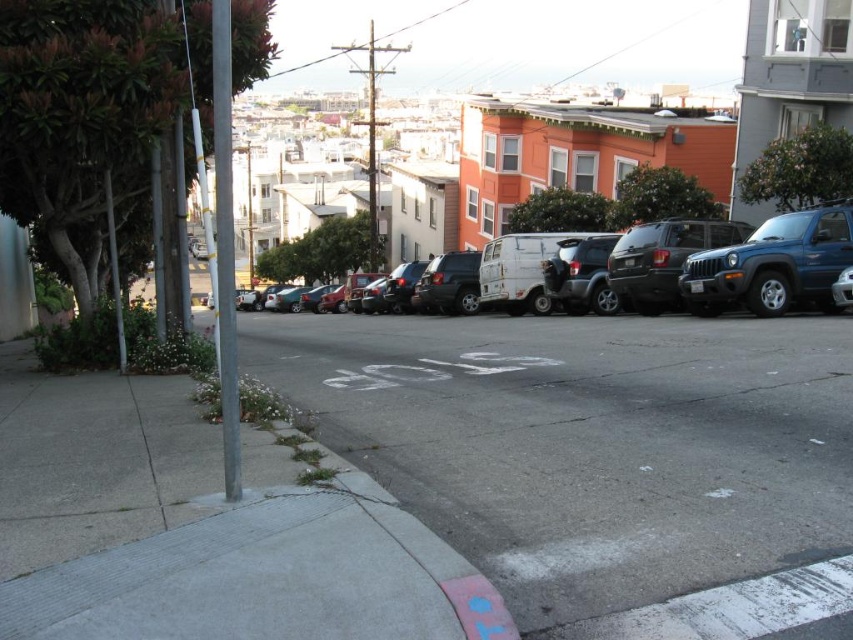
Does matte white van at center have a larger size compared to blue metallic suv at right?

Correct, matte white van at center is larger in size than blue metallic suv at right.

Does matte white van at center have a lesser width compared to blue metallic suv at right?

Incorrect, matte white van at center's width is not less than blue metallic suv at right's.

Is point (821, 264) positioned in front of point (717, 312)?

Yes, point (821, 264) is closer to viewer.

Image resolution: width=853 pixels, height=640 pixels. Identify the location of matte white van at center. (755, 262).

Who is positioned more to the right, blue metallic suv at right or silver metallic pole at left?

blue metallic suv at right is more to the right.

Identify the location of blue metallic suv at right. (773, 264).

Does matte white van at center come in front of silver metallic pole at left?

No.

Between matte white van at center and silver metallic pole at left, which one has less height?

Standing shorter between the two is silver metallic pole at left.

Between point (838, 205) and point (225, 64), which one is positioned behind?

Positioned behind is point (838, 205).

Locate an element on the screen. Image resolution: width=853 pixels, height=640 pixels. matte white van at center is located at coordinates (755, 262).